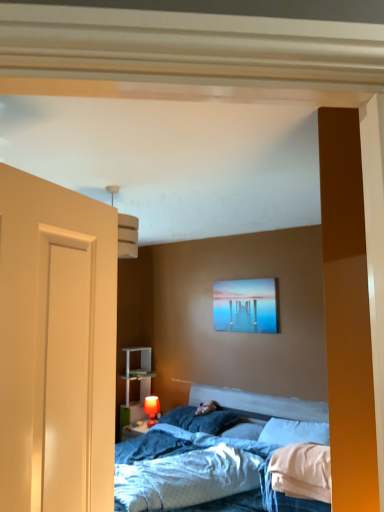
Question: Which direction should I rotate to look at blue soft pillow at center, which is counted as the third pillow, starting from the right?

Choices:
 (A) left
 (B) right

Answer: (B)

Question: From the image's perspective, is white plastic shelf at lower left on top of matte acrylic painting at upper center?

Choices:
 (A) no
 (B) yes

Answer: (A)

Question: Could matte acrylic painting at upper center be considered to be inside white plastic shelf at lower left?

Choices:
 (A) yes
 (B) no

Answer: (B)

Question: Does white plastic shelf at lower left have a greater height compared to matte acrylic painting at upper center?

Choices:
 (A) no
 (B) yes

Answer: (B)

Question: Is white plastic shelf at lower left next to matte acrylic painting at upper center?

Choices:
 (A) no
 (B) yes

Answer: (A)

Question: Does white plastic shelf at lower left have a greater width compared to matte acrylic painting at upper center?

Choices:
 (A) yes
 (B) no

Answer: (A)

Question: Is white plastic shelf at lower left not near matte acrylic painting at upper center?

Choices:
 (A) no
 (B) yes

Answer: (B)

Question: Is there a large distance between white soft pillow at center, the 2th pillow from the right, and matte red table lamp at lower center?

Choices:
 (A) no
 (B) yes

Answer: (B)

Question: Is white soft pillow at center, the 2th pillow from the right, at the right side of matte red table lamp at lower center?

Choices:
 (A) yes
 (B) no

Answer: (A)

Question: Would you say matte red table lamp at lower center is part of white soft pillow at center, which is counted as the second pillow, starting from the left,'s contents?

Choices:
 (A) no
 (B) yes

Answer: (A)

Question: Is white soft pillow at center, the 2th pillow from the right, looking in the opposite direction of matte red table lamp at lower center?

Choices:
 (A) no
 (B) yes

Answer: (A)

Question: Can you confirm if white soft pillow at center, which is counted as the second pillow, starting from the left, is smaller than matte red table lamp at lower center?

Choices:
 (A) no
 (B) yes

Answer: (A)

Question: From a real-world perspective, is white soft pillow at center, the 2th pillow from the right, located higher than matte red table lamp at lower center?

Choices:
 (A) no
 (B) yes

Answer: (B)

Question: Is matte red table lamp at lower center not inside white soft pillow at center, which is counted as the 3th pillow, starting from the left?

Choices:
 (A) no
 (B) yes

Answer: (B)